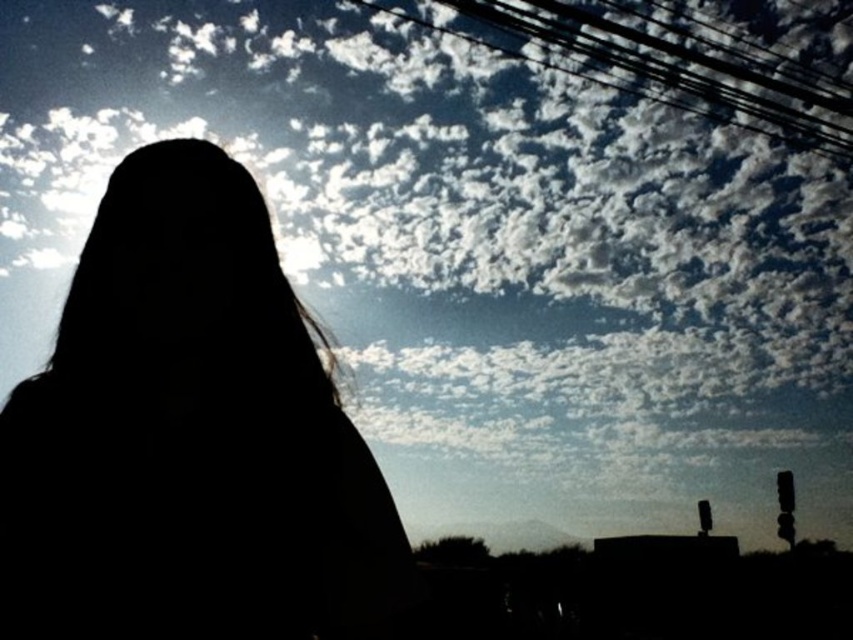
Question: Which object is closer to the camera taking this photo?

Choices:
 (A) black hair at center
 (B) black wire at upper center

Answer: (A)

Question: Is black hair at center behind black wire at upper center?

Choices:
 (A) yes
 (B) no

Answer: (B)

Question: Is black hair at center bigger than black wire at upper center?

Choices:
 (A) no
 (B) yes

Answer: (A)

Question: Is black hair at center to the right of black wire at upper center from the viewer's perspective?

Choices:
 (A) no
 (B) yes

Answer: (A)

Question: Which point is farther to the camera?

Choices:
 (A) (531, 36)
 (B) (294, 472)

Answer: (A)